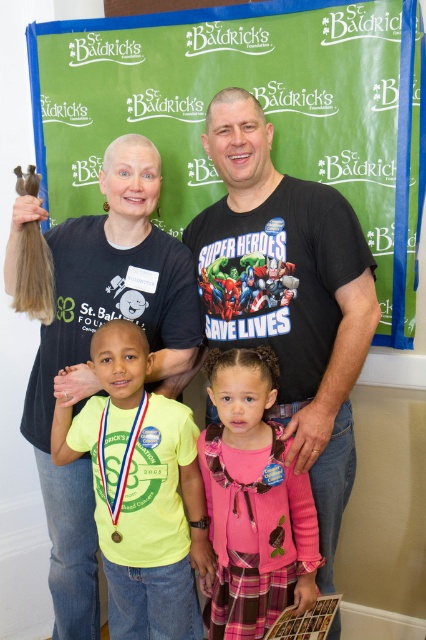
Is point (391, 131) behind point (328, 328)?

Yes, point (391, 131) is behind point (328, 328).

Describe the element at coordinates (259, 99) in the screenshot. I see `wooden plaque at center` at that location.

Locate an element on the screen. This screenshot has height=640, width=426. wooden plaque at center is located at coordinates (259, 99).

Who is positioned more to the left, wooden plaque at center or matte yellow shirt at center?

matte yellow shirt at center

Is point (57, 179) farther from camera compared to point (134, 630)?

Yes, point (57, 179) is farther from viewer.

You are a GUI agent. You are given a task and a screenshot of the screen. Output one action in this format:
    pyautogui.click(x=<x>, y=<y>)
    Task: Click on the wooden plaque at center
    
    Given the screenshot: What is the action you would take?
    pyautogui.click(x=259, y=99)

Does black cotton t-shirt at center have a larger size compared to matte brown hair at upper left?

Indeed, black cotton t-shirt at center has a larger size compared to matte brown hair at upper left.

Based on the photo, can you confirm if black cotton t-shirt at center is positioned to the right of matte brown hair at upper left?

Correct, you'll find black cotton t-shirt at center to the right of matte brown hair at upper left.

This screenshot has width=426, height=640. I want to click on black cotton t-shirt at center, so click(287, 296).